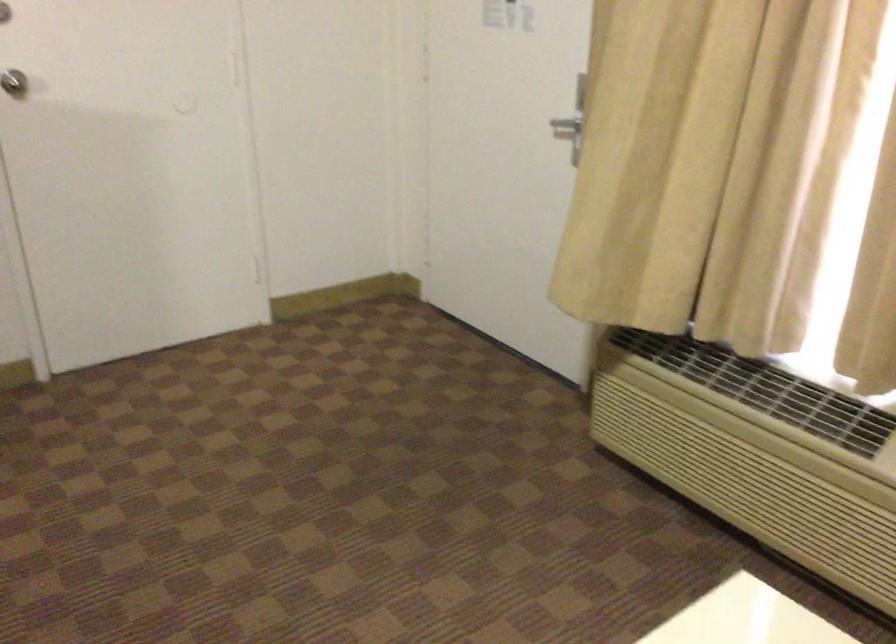
Find where to pull the silver door knob. Please return your answer as a coordinate pair (x, y).

(13, 82)